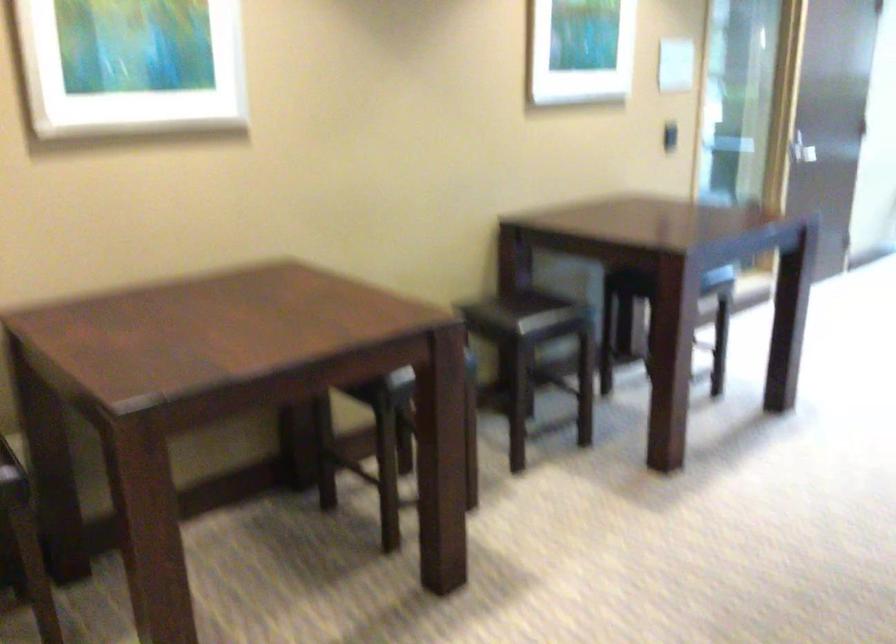
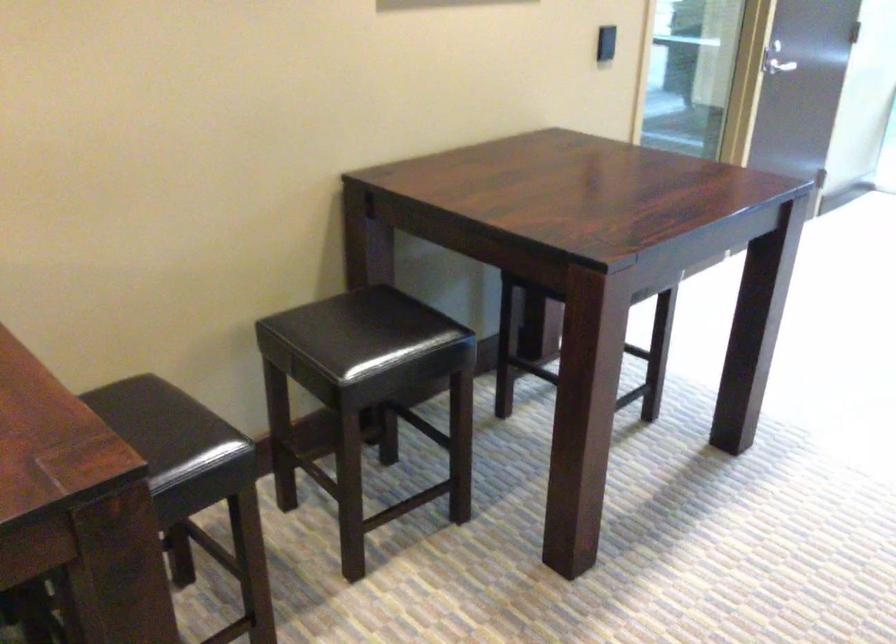
Question: In a continuous first-person perspective shot, in which direction is the camera moving?

Choices:
 (A) Left
 (B) Right
 (C) Forward
 (D) Backward

Answer: (C)